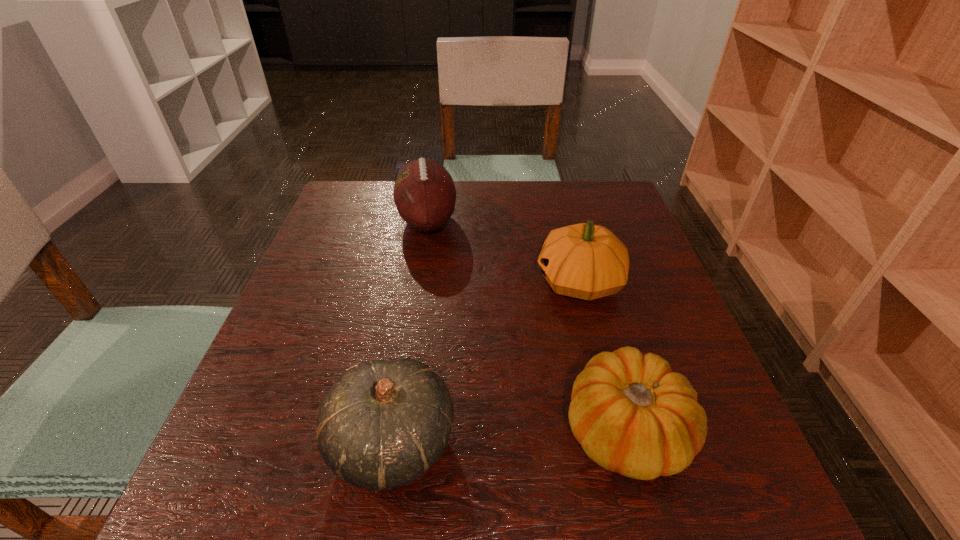
Locate an element on the screen. The width and height of the screenshot is (960, 540). empty location between the shortest gourd and the leftmost gourd is located at coordinates (509, 436).

What are the coordinates of `free space between the leftmost gourd and the second farthest object` in the screenshot? It's located at (487, 362).

Where is `vacant point located between the leftmost gourd and the shortest gourd`? The height and width of the screenshot is (540, 960). vacant point located between the leftmost gourd and the shortest gourd is located at coordinates (509, 436).

I want to click on vacant space in between the farthest object and the farthest gourd, so click(503, 251).

Locate an element on the screen. unoccupied position between the farthest gourd and the farthest object is located at coordinates (503, 251).

You are a GUI agent. You are given a task and a screenshot of the screen. Output one action in this format:
    pyautogui.click(x=<x>, y=<y>)
    Task: Click on the free spot between the second farthest object and the farthest object
    This screenshot has width=960, height=540.
    Given the screenshot: What is the action you would take?
    pyautogui.click(x=503, y=251)

Find the location of a particular element. Image resolution: width=960 pixels, height=540 pixels. free space between the farthest object and the shortest object is located at coordinates (526, 326).

Identify the location of empty space that is in between the football (American) and the shortest gourd. (526, 326).

Select which object is the third closest to the second farthest object. Please provide its 2D coordinates. Your answer should be formatted as a tuple, i.e. [(x, y)], where the tuple contains the x and y coordinates of a point satisfying the conditions above.

[(383, 423)]

At what (x,y) coordinates should I click in order to perform the action: click on object that can be found as the third closest to the second farthest object. Please return your answer as a coordinate pair (x, y). This screenshot has height=540, width=960. Looking at the image, I should click on (383, 423).